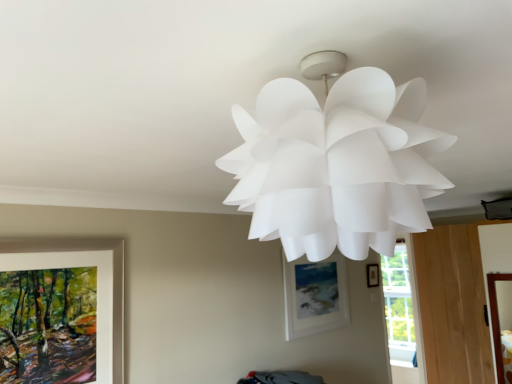
Where is `white matte picture frame at center, which is the second picture frame in right-to-left order`? white matte picture frame at center, which is the second picture frame in right-to-left order is located at coordinates (315, 295).

What is the approximate height of transparent glass window at lower right?

1.64 meters.

This screenshot has width=512, height=384. In order to click on white matte picture frame at center, the 2th picture frame viewed from the front in this screenshot , I will do `click(315, 295)`.

Can you tell me how much white paper lamp at upper center and transparent glass window at lower right differ in facing direction?

They differ by 90.5 degrees in their facing directions.

From a real-world perspective, is white paper lamp at upper center on transparent glass window at lower right?

Yes, from a real-world perspective, white paper lamp at upper center is on top of transparent glass window at lower right.

From the image's perspective, which is above, white paper lamp at upper center or transparent glass window at lower right?

white paper lamp at upper center appears higher in the image.

Does white paper lamp at upper center touch transparent glass window at lower right?

No, white paper lamp at upper center is not with transparent glass window at lower right.

Which is more to the left, wooden picture frame at lower left, the 3th picture frame from the back, or white matte picture frame at center, which is the second picture frame in right-to-left order?

wooden picture frame at lower left, the 3th picture frame from the back, is more to the left.

Is wooden picture frame at lower left, which is counted as the 3th picture frame, starting from the right, aimed at white matte picture frame at center, the second picture frame viewed from the back?

No, wooden picture frame at lower left, which is counted as the 3th picture frame, starting from the right, is not facing towards white matte picture frame at center, the second picture frame viewed from the back.

From the image's perspective, does wooden picture frame at lower left, arranged as the 1th picture frame when viewed from the front, appear higher than white matte picture frame at center, the 2th picture frame viewed from the front?

Yes, from the image's perspective, wooden picture frame at lower left, arranged as the 1th picture frame when viewed from the front, is over white matte picture frame at center, the 2th picture frame viewed from the front.

You are a GUI agent. You are given a task and a screenshot of the screen. Output one action in this format:
    pyautogui.click(x=<x>, y=<y>)
    Task: Click on the picture frame located underneath the wooden picture frame at lower left, which is counted as the 3th picture frame, starting from the right (from a real-world perspective)
    Image resolution: width=512 pixels, height=384 pixels.
    Given the screenshot: What is the action you would take?
    pyautogui.click(x=315, y=295)

Does transparent glass window at lower right lie behind matte black picture frame at center-right, which is the first picture frame from back to front?

Yes, it is.

In terms of height, does transparent glass window at lower right look taller or shorter compared to matte black picture frame at center-right, acting as the first picture frame starting from the right?

Considering their sizes, transparent glass window at lower right has more height than matte black picture frame at center-right, acting as the first picture frame starting from the right.

Does transparent glass window at lower right turn towards matte black picture frame at center-right, which is the 3th picture frame from left to right?

No, transparent glass window at lower right is not aimed at matte black picture frame at center-right, which is the 3th picture frame from left to right.

Can matte black picture frame at center-right, the 3th picture frame when ordered from front to back, be found inside transparent glass window at lower right?

No, matte black picture frame at center-right, the 3th picture frame when ordered from front to back, is located outside of transparent glass window at lower right.

From the picture: From the image's perspective, does transparent glass window at lower right appear lower than wooden picture frame at lower left, acting as the first picture frame starting from the left?

Yes.

Is transparent glass window at lower right completely or partially outside of wooden picture frame at lower left, the 3th picture frame from the back?

transparent glass window at lower right lies outside wooden picture frame at lower left, the 3th picture frame from the back,'s area.

In terms of height, does transparent glass window at lower right look taller or shorter compared to wooden picture frame at lower left, which is counted as the 3th picture frame, starting from the right?

transparent glass window at lower right is taller than wooden picture frame at lower left, which is counted as the 3th picture frame, starting from the right.

Is white matte picture frame at center, the 2th picture frame viewed from the front, in front of or behind wooden picture frame at lower left, which is counted as the 3th picture frame, starting from the right, in the image?

In the image, white matte picture frame at center, the 2th picture frame viewed from the front, appears behind wooden picture frame at lower left, which is counted as the 3th picture frame, starting from the right.

Can you tell me how much white matte picture frame at center, arranged as the second picture frame when viewed from the left, and wooden picture frame at lower left, acting as the first picture frame starting from the left, differ in facing direction?

1 degrees.

Looking at their sizes, would you say white matte picture frame at center, arranged as the second picture frame when viewed from the left, is wider or thinner than wooden picture frame at lower left, the 3th picture frame from the back?

white matte picture frame at center, arranged as the second picture frame when viewed from the left, is thinner than wooden picture frame at lower left, the 3th picture frame from the back.

Is white matte picture frame at center, the second picture frame viewed from the back, not inside wooden picture frame at lower left, acting as the first picture frame starting from the left?

Yes, white matte picture frame at center, the second picture frame viewed from the back, is outside of wooden picture frame at lower left, acting as the first picture frame starting from the left.

Is white matte picture frame at center, arranged as the second picture frame when viewed from the left, positioned with its back to transparent glass window at lower right?

No.

Which of these two, white matte picture frame at center, arranged as the second picture frame when viewed from the left, or transparent glass window at lower right, stands taller?

Standing taller between the two is transparent glass window at lower right.

Which is correct: white matte picture frame at center, which is the second picture frame in right-to-left order, is inside transparent glass window at lower right, or outside of it?

white matte picture frame at center, which is the second picture frame in right-to-left order, is located beyond the bounds of transparent glass window at lower right.

Which object is closer to the camera taking this photo, white matte picture frame at center, arranged as the second picture frame when viewed from the left, or transparent glass window at lower right?

white matte picture frame at center, arranged as the second picture frame when viewed from the left, is more forward.

Which is in front, white matte picture frame at center, arranged as the second picture frame when viewed from the left, or white paper lamp at upper center?

white paper lamp at upper center is closer to the camera.

Would you say white matte picture frame at center, the 2th picture frame viewed from the front, contains white paper lamp at upper center?

Definitely not — white paper lamp at upper center is not inside white matte picture frame at center, the 2th picture frame viewed from the front.

From a real-world perspective, is white matte picture frame at center, which is the second picture frame in right-to-left order, below white paper lamp at upper center?

Yes, from a real-world perspective, white matte picture frame at center, which is the second picture frame in right-to-left order, is beneath white paper lamp at upper center.

Measure the distance from white matte picture frame at center, arranged as the second picture frame when viewed from the left, to white paper lamp at upper center.

white matte picture frame at center, arranged as the second picture frame when viewed from the left, and white paper lamp at upper center are 8.17 feet apart from each other.

At what (x,y) coordinates should I click in order to perform the action: click on lamp above the transparent glass window at lower right (from the image's perspective). Please return your answer as a coordinate pair (x, y). The image size is (512, 384). Looking at the image, I should click on (336, 165).

Locate an element on the screen. This screenshot has height=384, width=512. picture frame on the left side of white matte picture frame at center, the second picture frame viewed from the back is located at coordinates (97, 280).

Looking at the image, which one is located closer to wooden picture frame at lower left, arranged as the 1th picture frame when viewed from the front, white matte picture frame at center, the 2th picture frame viewed from the front, or matte black picture frame at center-right, acting as the first picture frame starting from the right?

white matte picture frame at center, the 2th picture frame viewed from the front, lies closer to wooden picture frame at lower left, arranged as the 1th picture frame when viewed from the front, than the other object.

Considering their positions, is white matte picture frame at center, arranged as the second picture frame when viewed from the left, positioned closer to transparent glass window at lower right than wooden picture frame at lower left, which is counted as the 3th picture frame, starting from the right?

white matte picture frame at center, arranged as the second picture frame when viewed from the left, is positioned closer to the anchor transparent glass window at lower right.

Which object lies further to the anchor point white matte picture frame at center, which is the second picture frame in right-to-left order, wooden picture frame at lower left, the 3th picture frame from the back, or matte black picture frame at center-right, acting as the first picture frame starting from the right?

Based on the image, wooden picture frame at lower left, the 3th picture frame from the back, appears to be further to white matte picture frame at center, which is the second picture frame in right-to-left order.

When comparing their distances from white matte picture frame at center, arranged as the second picture frame when viewed from the left, does wooden picture frame at lower left, acting as the first picture frame starting from the left, or transparent glass window at lower right seem closer?

transparent glass window at lower right is positioned closer to the anchor white matte picture frame at center, arranged as the second picture frame when viewed from the left.

Estimate the real-world distances between objects in this image. Which object is further from transparent glass window at lower right, wooden picture frame at lower left, the 3th picture frame from the back, or white matte picture frame at center, the 2th picture frame viewed from the front?

wooden picture frame at lower left, the 3th picture frame from the back, is further to transparent glass window at lower right.

Based on their spatial positions, is white matte picture frame at center, the second picture frame viewed from the back, or transparent glass window at lower right further from wooden picture frame at lower left, acting as the first picture frame starting from the left?

transparent glass window at lower right.

Estimate the real-world distances between objects in this image. Which object is closer to white paper lamp at upper center, transparent glass window at lower right or matte black picture frame at center-right, the 3th picture frame when ordered from front to back?

matte black picture frame at center-right, the 3th picture frame when ordered from front to back, is positioned closer to the anchor white paper lamp at upper center.

Based on their spatial positions, is wooden picture frame at lower left, the 3th picture frame from the back, or white matte picture frame at center, which is the second picture frame in right-to-left order, further from matte black picture frame at center-right, which is the 3th picture frame from left to right?

wooden picture frame at lower left, the 3th picture frame from the back, is positioned further to the anchor matte black picture frame at center-right, which is the 3th picture frame from left to right.

Where is `picture frame between white matte picture frame at center, arranged as the second picture frame when viewed from the left, and transparent glass window at lower right, along the z-axis`? The height and width of the screenshot is (384, 512). picture frame between white matte picture frame at center, arranged as the second picture frame when viewed from the left, and transparent glass window at lower right, along the z-axis is located at coordinates (373, 275).

Find the location of a particular element. The width and height of the screenshot is (512, 384). picture frame between white paper lamp at upper center and white matte picture frame at center, the 2th picture frame viewed from the front, in the front-back direction is located at coordinates (97, 280).

The width and height of the screenshot is (512, 384). Find the location of `picture frame between wooden picture frame at lower left, which is counted as the 3th picture frame, starting from the right, and matte black picture frame at center-right, the 3th picture frame when ordered from front to back, in the front-back direction`. picture frame between wooden picture frame at lower left, which is counted as the 3th picture frame, starting from the right, and matte black picture frame at center-right, the 3th picture frame when ordered from front to back, in the front-back direction is located at coordinates (315, 295).